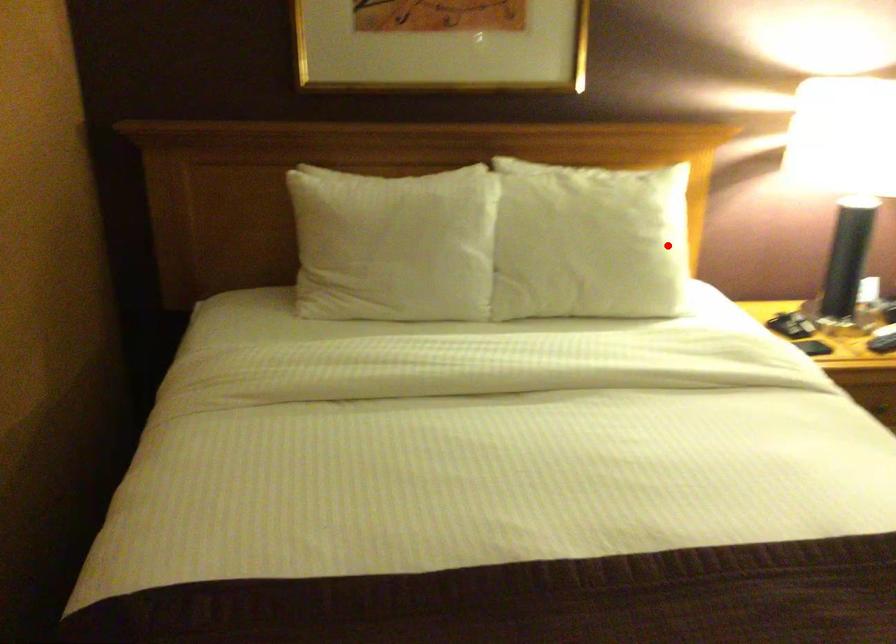
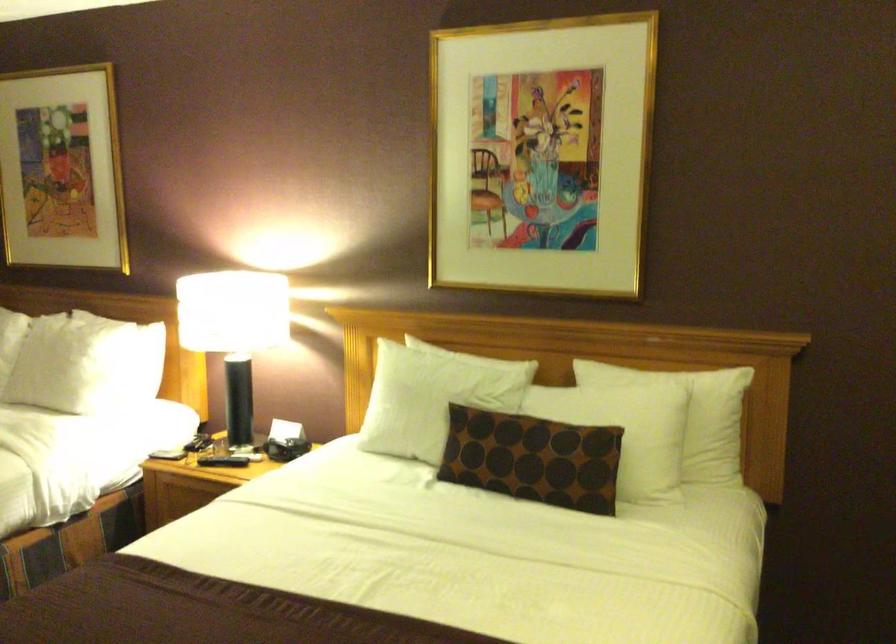
Question: I am providing you with two images of the same scene from different viewpoints. Given a red point in image1, look at the same physical point in image2. Is it:

Choices:
 (A) Closer to the viewpoint
 (B) Farther from the viewpoint

Answer: (B)